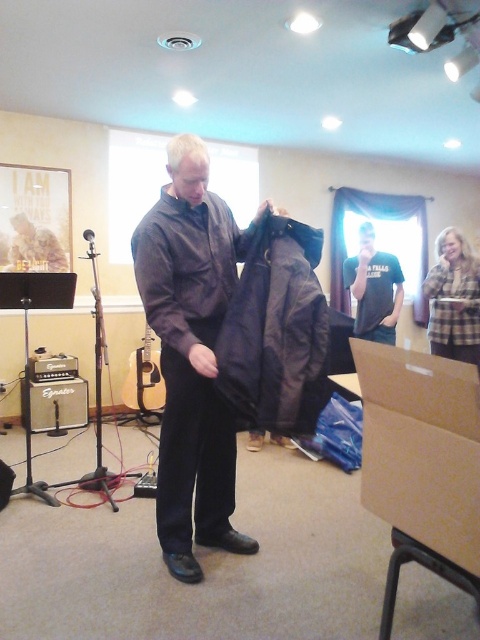
Between point (140, 228) and point (373, 291), which one is positioned in front?

Point (140, 228)

From the picture: Which of these two, matte black jacket at center or black cotton t-shirt at center, stands taller?

matte black jacket at center

Who is more forward, (132, 252) or (361, 250)?

Positioned in front is point (132, 252).

Where is `matte black jacket at center`? Image resolution: width=480 pixels, height=640 pixels. matte black jacket at center is located at coordinates (191, 355).

Does brown cardboard box at lower right appear under leather jacket at center?

Correct, brown cardboard box at lower right is located below leather jacket at center.

Is point (439, 497) positioned after point (211, 227)?

That is False.

I want to click on brown cardboard box at lower right, so click(x=421, y=448).

Between leather jacket at center and black cotton t-shirt at center, which one has less height?

leather jacket at center

Which of these two, leather jacket at center or black cotton t-shirt at center, stands taller?

With more height is black cotton t-shirt at center.

Who is more forward, (192, 218) or (360, 272)?

Positioned in front is point (192, 218).

You are a GUI agent. You are given a task and a screenshot of the screen. Output one action in this format:
    pyautogui.click(x=<x>, y=<y>)
    Task: Click on the leather jacket at center
    The image size is (480, 640).
    Given the screenshot: What is the action you would take?
    pyautogui.click(x=188, y=268)